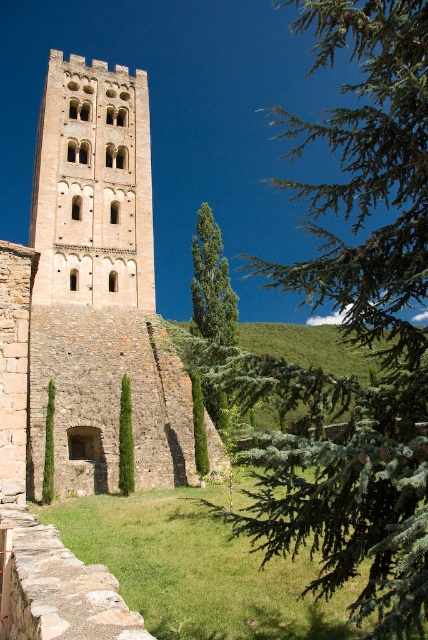
Is light brown stone tower at center wider than green leafy tree at center?

Yes, light brown stone tower at center is wider than green leafy tree at center.

Can you confirm if light brown stone tower at center is smaller than green leafy tree at center?

Correct, light brown stone tower at center occupies less space than green leafy tree at center.

Is point (113, 150) positioned in front of point (219, 340)?

No.

Locate an element on the screen. The height and width of the screenshot is (640, 428). light brown stone tower at center is located at coordinates (92, 186).

Find the location of a particular element. This screenshot has height=640, width=428. beige stone tower at center is located at coordinates [89, 300].

The image size is (428, 640). Identify the location of beige stone tower at center. (89, 300).

Does beige stone tower at center have a lesser height compared to green leafy tree at center?

Incorrect, beige stone tower at center's height does not fall short of green leafy tree at center's.

From the picture: Is beige stone tower at center further to camera compared to green leafy tree at center?

Yes, it is behind green leafy tree at center.

Which is behind, point (174, 444) or point (208, 268)?

The point (208, 268) is behind.

The height and width of the screenshot is (640, 428). What are the coordinates of `beige stone tower at center` in the screenshot? It's located at coord(89,300).